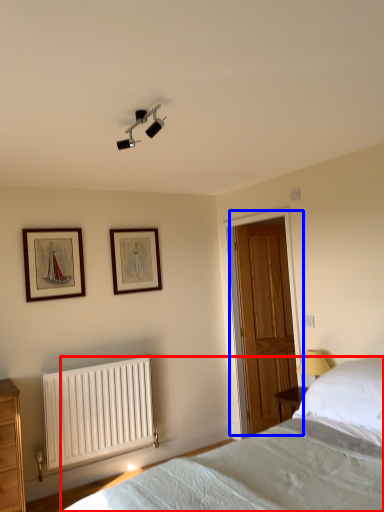
Question: Which object is closer to the camera taking this photo, bed (highlighted by a red box) or door (highlighted by a blue box)?

Choices:
 (A) bed
 (B) door

Answer: (A)